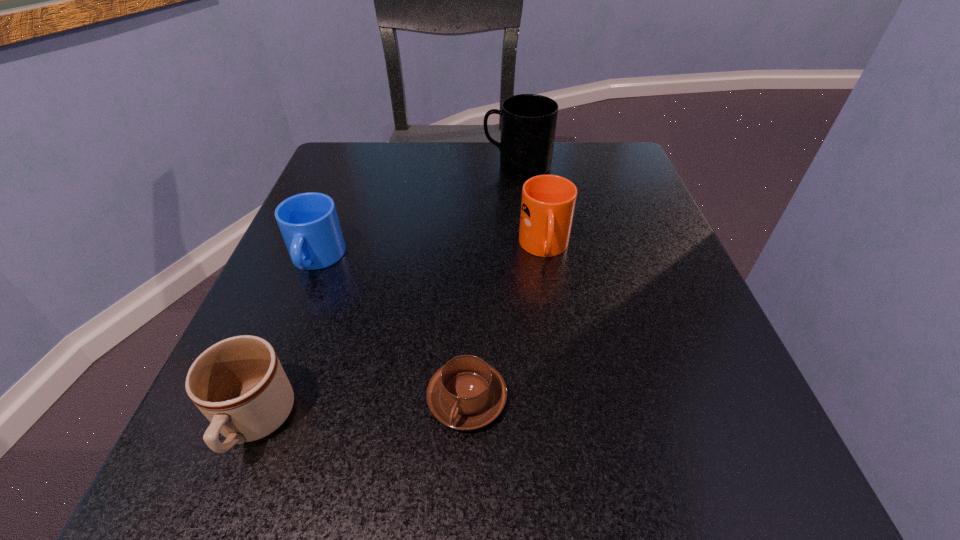
Where is `object located in the near left corner section of the desktop`? The image size is (960, 540). object located in the near left corner section of the desktop is located at coordinates (239, 385).

The height and width of the screenshot is (540, 960). Find the location of `free space at the near edge of the desktop`. free space at the near edge of the desktop is located at coordinates (493, 488).

Locate an element on the screen. The width and height of the screenshot is (960, 540). free region at the left edge of the desktop is located at coordinates click(x=342, y=220).

Locate an element on the screen. The height and width of the screenshot is (540, 960). free spot at the right edge of the desktop is located at coordinates (617, 385).

This screenshot has width=960, height=540. I want to click on vacant space at the far left corner, so click(399, 153).

Where is `vacant space at the far right corner`? vacant space at the far right corner is located at coordinates (618, 188).

The height and width of the screenshot is (540, 960). I want to click on free space at the near right corner of the desktop, so click(x=684, y=493).

Where is `unoccupied position between the farthest object and the cappuccino`? The image size is (960, 540). unoccupied position between the farthest object and the cappuccino is located at coordinates (492, 282).

Locate an element on the screen. This screenshot has width=960, height=540. free space between the cappuccino and the nearest mug is located at coordinates (361, 411).

At what (x,y) coordinates should I click in order to perform the action: click on empty space that is in between the shortest object and the farthest mug. Please return your answer as a coordinate pair (x, y). The height and width of the screenshot is (540, 960). Looking at the image, I should click on (492, 282).